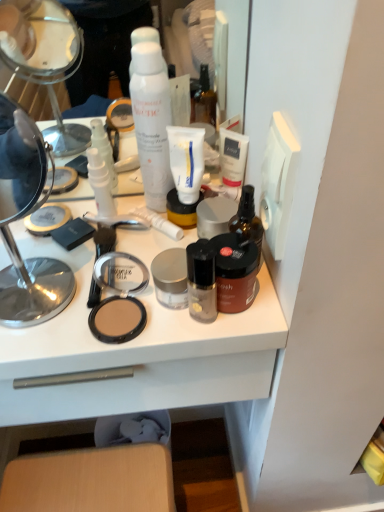
Find the location of a particular element. The height and width of the screenshot is (512, 384). blank area to the left of white matte shaving cream at center is located at coordinates (76, 225).